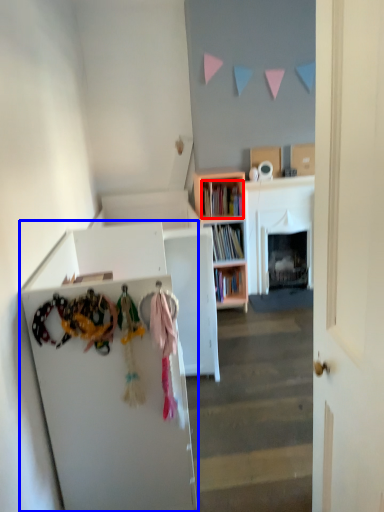
Question: Which point is closer to the camera, book (highlighted by a red box) or cabinetry (highlighted by a blue box)?

Choices:
 (A) book
 (B) cabinetry

Answer: (B)